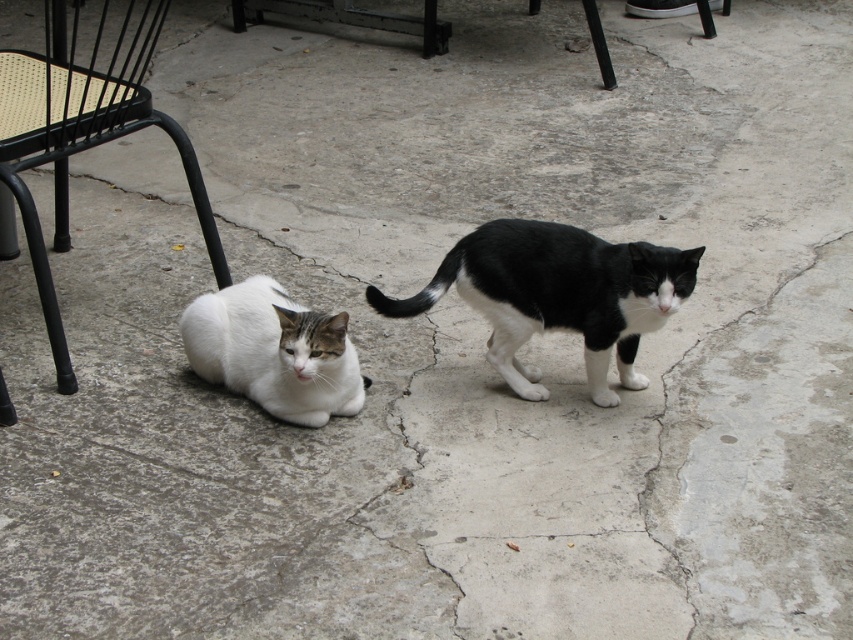
You are sitting on the black metal chair at left and want to reach the white fur cat at lower left. Which direction should you move to get closer to the cat?

Since the black metal chair at left is further to the viewer than the white fur cat at lower left, you should move forward towards the cat to get closer.

You are a photographer trying to capture a closeup of the cat on the left. You have a lens that can focus on objects at a distance of up to 1 meter. The distance between point (662, 300) and point (195, 205) in the image corresponds to 1.2 meters in real life. Can you focus on the cat on the left using your current lens?

The distance between point (662, 300) and point (195, 205) is 1.2 meters in real life. Since point (662, 300) is closer to the camera than point (195, 205), the cat on the left is within the 1 meter focus range of your lens. Therefore, you can focus on the cat on the left using your current lens.